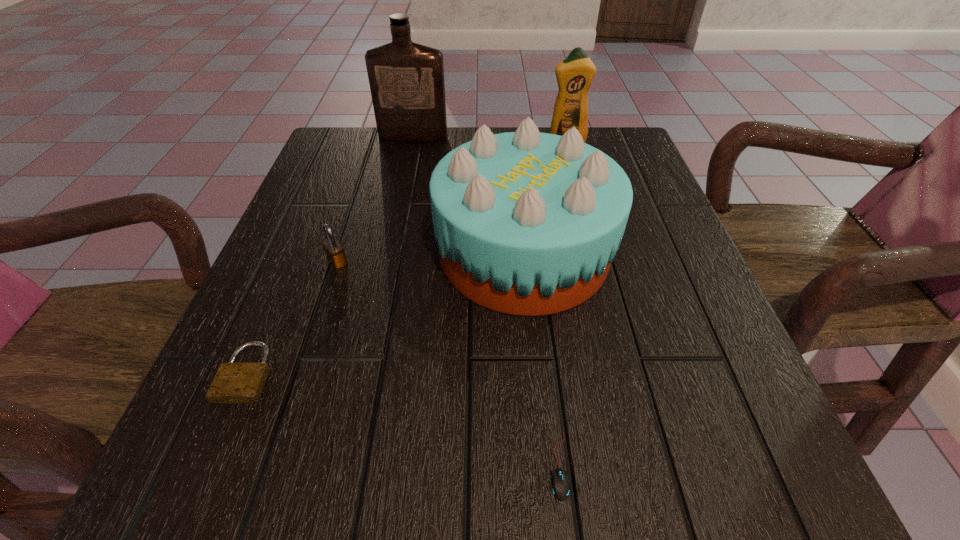
Identify the location of vacant space positioned on the label of the detergent. This screenshot has width=960, height=540. (588, 227).

The width and height of the screenshot is (960, 540). Identify the location of free point located 0.150m on the back of the cake. (515, 163).

I want to click on vacant area situated on the right of the right padlock, so click(x=423, y=262).

Where is `vacant position located 0.090m on the keyhole side of the fifth farthest object`? The height and width of the screenshot is (540, 960). vacant position located 0.090m on the keyhole side of the fifth farthest object is located at coordinates (207, 468).

Find the location of a particular element. Image resolution: width=960 pixels, height=540 pixels. vacant area located on the back of the nearest object is located at coordinates (548, 387).

In order to click on liquor located at the far edge in this screenshot , I will do `click(406, 79)`.

The image size is (960, 540). In order to click on detergent located in the far edge section of the desktop in this screenshot , I will do `click(575, 73)`.

Locate an element on the screen. The image size is (960, 540). object at the near edge is located at coordinates (559, 484).

Locate an element on the screen. The image size is (960, 540). liquor that is positioned at the left edge is located at coordinates (406, 79).

Where is `detergent that is at the right edge`? detergent that is at the right edge is located at coordinates (575, 73).